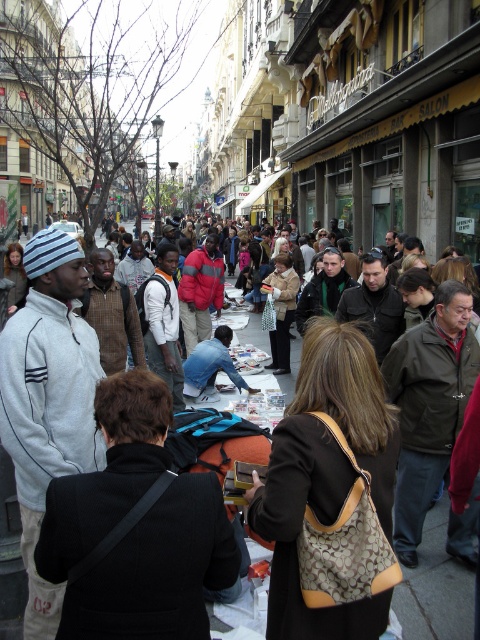
Question: Does white fleece jacket at left appear on the right side of dark brown leather jacket at center?

Choices:
 (A) no
 (B) yes

Answer: (A)

Question: Can you confirm if white fleece jacket at left is thinner than dark brown leather jacket at center?

Choices:
 (A) yes
 (B) no

Answer: (A)

Question: Which point appears closest to the camera in this image?

Choices:
 (A) (451, 593)
 (B) (38, 576)

Answer: (B)

Question: Considering the relative positions of white fleece jacket at left and dark brown leather jacket at center in the image provided, where is white fleece jacket at left located with respect to dark brown leather jacket at center?

Choices:
 (A) left
 (B) right

Answer: (A)